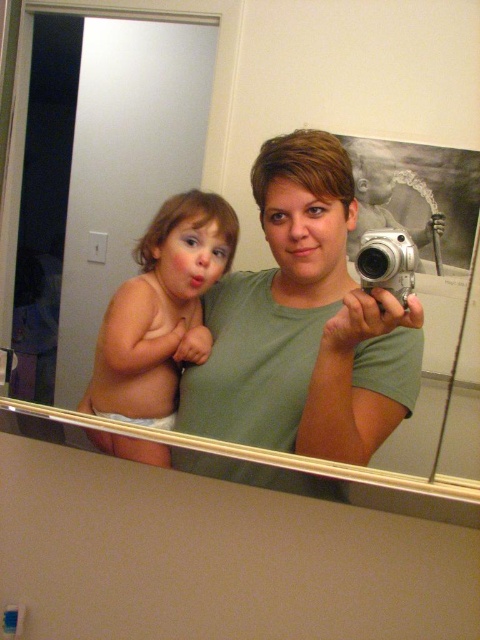
Is matte green shirt at center wider than silver metallic camera at center?

Yes.

Is point (264, 360) positioned before point (400, 305)?

That is False.

This screenshot has width=480, height=640. Describe the element at coordinates (303, 324) in the screenshot. I see `matte green shirt at center` at that location.

Image resolution: width=480 pixels, height=640 pixels. Identify the location of matte green shirt at center. (303, 324).

Is matte green shirt at center behind smooth skin baby at left?

No, it is not.

Can you confirm if matte green shirt at center is thinner than smooth skin baby at left?

Incorrect, matte green shirt at center's width is not less than smooth skin baby at left's.

Is point (302, 296) positioned before point (153, 412)?

Yes, point (302, 296) is in front of point (153, 412).

Where is `matte green shirt at center`? matte green shirt at center is located at coordinates (303, 324).

Can you confirm if smooth skin baby at left is smaller than silver metallic camera at center?

No, smooth skin baby at left is not smaller than silver metallic camera at center.

Find the location of a particular element. Image resolution: width=480 pixels, height=640 pixels. smooth skin baby at left is located at coordinates (162, 307).